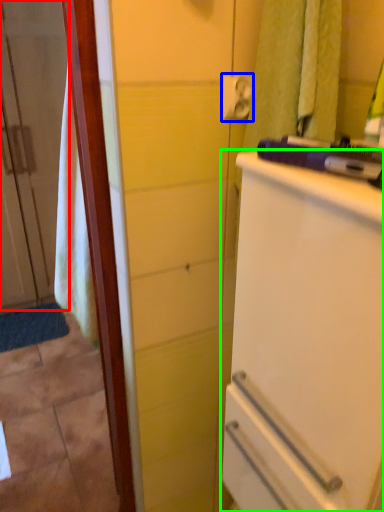
Question: Estimate the real-world distances between objects in this image. Which object is farther from door (highlighted by a red box), towel bar (highlighted by a blue box) or refrigerator (highlighted by a green box)?

Choices:
 (A) towel bar
 (B) refrigerator

Answer: (B)